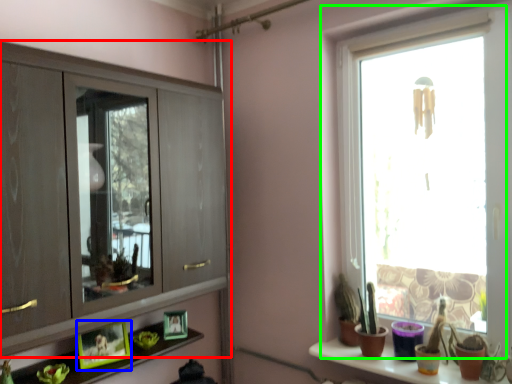
Question: Considering the real-world distances, which object is farthest from cupboard (highlighted by a red box)? picture frame (highlighted by a blue box) or window (highlighted by a green box)?

Choices:
 (A) picture frame
 (B) window

Answer: (B)